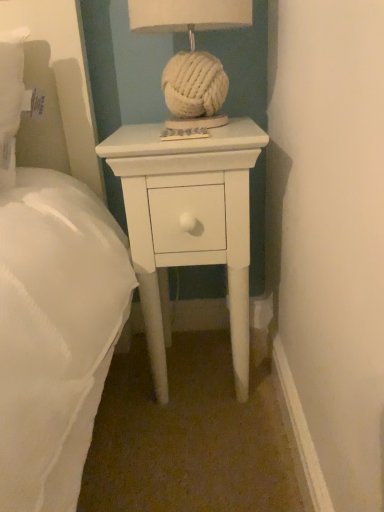
The height and width of the screenshot is (512, 384). Describe the element at coordinates (192, 51) in the screenshot. I see `white knitted ball at center` at that location.

Locate an element on the screen. Image resolution: width=384 pixels, height=512 pixels. white knitted ball at center is located at coordinates (192, 51).

The image size is (384, 512). Describe the element at coordinates (179, 207) in the screenshot. I see `white matte nightstand at center` at that location.

What is the approximate height of white matte nightstand at center?

white matte nightstand at center is 25.34 inches tall.

Where is `white matte nightstand at center`? The height and width of the screenshot is (512, 384). white matte nightstand at center is located at coordinates (179, 207).

Image resolution: width=384 pixels, height=512 pixels. What are the coordinates of `white knitted ball at center` in the screenshot? It's located at (192, 51).

Which object is positioned more to the right, white knitted ball at center or white matte nightstand at center?

white matte nightstand at center is more to the right.

Between white knitted ball at center and white matte nightstand at center, which one is positioned behind?

white matte nightstand at center is more distant.

Considering the points (207, 19) and (157, 343), which point is in front, point (207, 19) or point (157, 343)?

The point (207, 19) is closer to the camera.

From the image's perspective, is white knitted ball at center positioned above or below white matte nightstand at center?

Based on their image positions, white knitted ball at center is located above white matte nightstand at center.

From a real-world perspective, is white knitted ball at center below white matte nightstand at center?

Incorrect, from a real-world perspective, white knitted ball at center is higher than white matte nightstand at center.

Is white knitted ball at center wider or thinner than white matte nightstand at center?

In the image, white knitted ball at center appears to be more narrow than white matte nightstand at center.

In the scene shown: Considering the sizes of white knitted ball at center and white matte nightstand at center in the image, is white knitted ball at center taller or shorter than white matte nightstand at center?

In the image, white knitted ball at center appears to be shorter than white matte nightstand at center.

Who is bigger, white knitted ball at center or white matte nightstand at center?

white matte nightstand at center.

Is white knitted ball at center inside the boundaries of white matte nightstand at center, or outside?

The correct answer is: outside.

Is white knitted ball at center touching white matte nightstand at center?

white knitted ball at center is not next to white matte nightstand at center, and they're not touching.

Could you tell me if white knitted ball at center is turned towards white matte nightstand at center?

No, white knitted ball at center does not turn towards white matte nightstand at center.

How many degrees apart are the facing directions of white knitted ball at center and white matte nightstand at center?

The angle between the facing direction of white knitted ball at center and the facing direction of white matte nightstand at center is 0.0042 degrees.

Where is `table lamp in front of the white matte nightstand at center`? The width and height of the screenshot is (384, 512). table lamp in front of the white matte nightstand at center is located at coordinates (192, 51).

Considering the positions of objects white matte nightstand at center and white knitted ball at center in the image provided, who is more to the right, white matte nightstand at center or white knitted ball at center?

Positioned to the right is white matte nightstand at center.

Between white matte nightstand at center and white knitted ball at center, which one is positioned in front?

white knitted ball at center is in front.

Which point is more distant from viewer, (235, 373) or (167, 72)?

The point (235, 373) is behind.

From the image's perspective, which is above, white matte nightstand at center or white knitted ball at center?

white knitted ball at center, from the image's perspective.

Looking at this image, from a real-world perspective, is white matte nightstand at center beneath white knitted ball at center?

Indeed, from a real-world perspective, white matte nightstand at center is positioned beneath white knitted ball at center.

Considering the relative sizes of white matte nightstand at center and white knitted ball at center in the image provided, is white matte nightstand at center wider than white knitted ball at center?

Yes, white matte nightstand at center is wider than white knitted ball at center.

Considering the sizes of white matte nightstand at center and white knitted ball at center in the image, is white matte nightstand at center taller or shorter than white knitted ball at center?

white matte nightstand at center is taller than white knitted ball at center.

Based on the photo, does white matte nightstand at center have a larger size compared to white knitted ball at center?

Yes, white matte nightstand at center is bigger than white knitted ball at center.

Would you say white matte nightstand at center is inside or outside white knitted ball at center?

white matte nightstand at center lies outside white knitted ball at center.

Is white matte nightstand at center placed right next to white knitted ball at center?

No, white matte nightstand at center is not in contact with white knitted ball at center.

Is white matte nightstand at center facing away from white knitted ball at center?

No, white matte nightstand at center's orientation is not away from white knitted ball at center.

The image size is (384, 512). In order to click on table lamp in front of the white matte nightstand at center in this screenshot , I will do `click(192, 51)`.

The image size is (384, 512). I want to click on nightstand behind the white knitted ball at center, so click(179, 207).

In the image, there is a white knitted ball at center. At what (x,y) coordinates should I click in order to perform the action: click on nightstand below it (from a real-world perspective). Please return your answer as a coordinate pair (x, y). The width and height of the screenshot is (384, 512). Looking at the image, I should click on (179, 207).